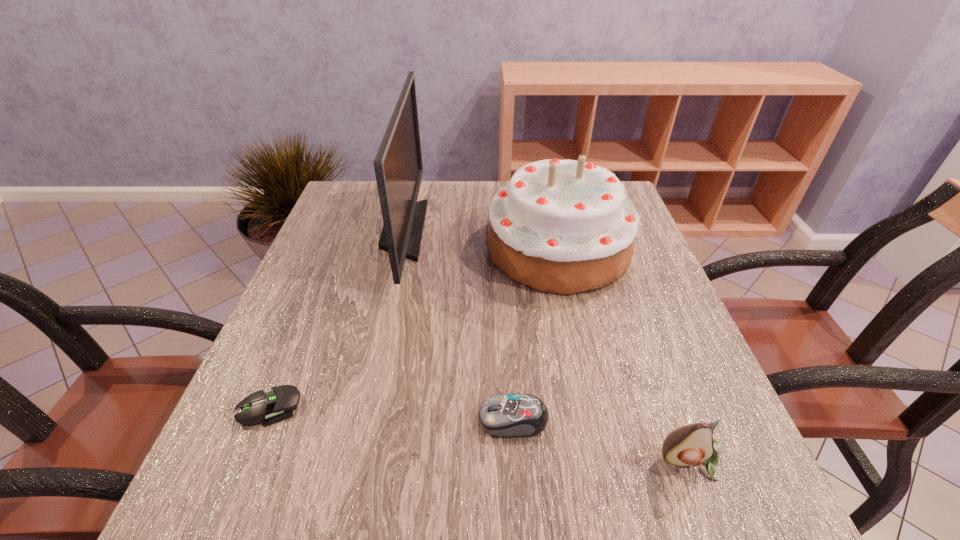
Identify the location of vacant point located 0.330m on the front of the cake. The height and width of the screenshot is (540, 960). (601, 443).

At what (x,y) coordinates should I click in order to perform the action: click on free space located on the seed side of the third tallest object. Please return your answer as a coordinate pair (x, y). The height and width of the screenshot is (540, 960). Looking at the image, I should click on (719, 534).

Locate an element on the screen. This screenshot has height=540, width=960. vacant space located on the wheel side of the right computer mouse is located at coordinates (399, 420).

Locate an element on the screen. The image size is (960, 540). vacant space located 0.400m on the wheel side of the right computer mouse is located at coordinates (233, 420).

The image size is (960, 540). I want to click on free spot located on the wheel side of the right computer mouse, so click(x=387, y=420).

In order to click on vacant space located 0.260m on the back of the leftmost object in this screenshot , I will do `click(320, 286)`.

You are a GUI agent. You are given a task and a screenshot of the screen. Output one action in this format:
    pyautogui.click(x=<x>, y=<y>)
    Task: Click on the monitor located at the far edge
    The width and height of the screenshot is (960, 540).
    Given the screenshot: What is the action you would take?
    pyautogui.click(x=398, y=166)

I want to click on cake positioned at the far edge, so click(x=560, y=226).

The height and width of the screenshot is (540, 960). Find the location of `object located at the near edge`. object located at the near edge is located at coordinates (693, 444).

Locate an element on the screen. Image resolution: width=960 pixels, height=540 pixels. monitor at the left edge is located at coordinates (398, 166).